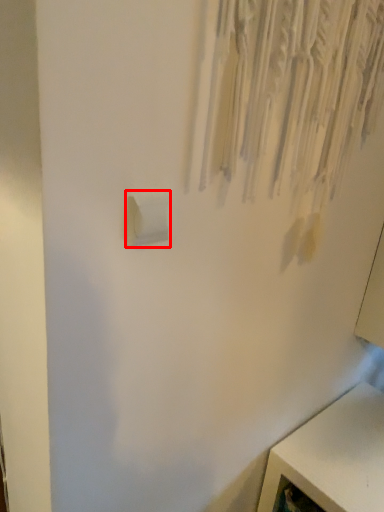
Question: From the image's perspective, where is light switch (annotated by the red box) located relative to furniture?

Choices:
 (A) below
 (B) above

Answer: (B)